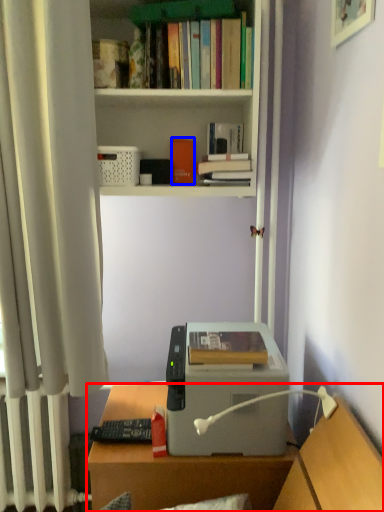
Question: Which object is further to the camera taking this photo, desk (highlighted by a red box) or paperback book (highlighted by a blue box)?

Choices:
 (A) desk
 (B) paperback book

Answer: (B)